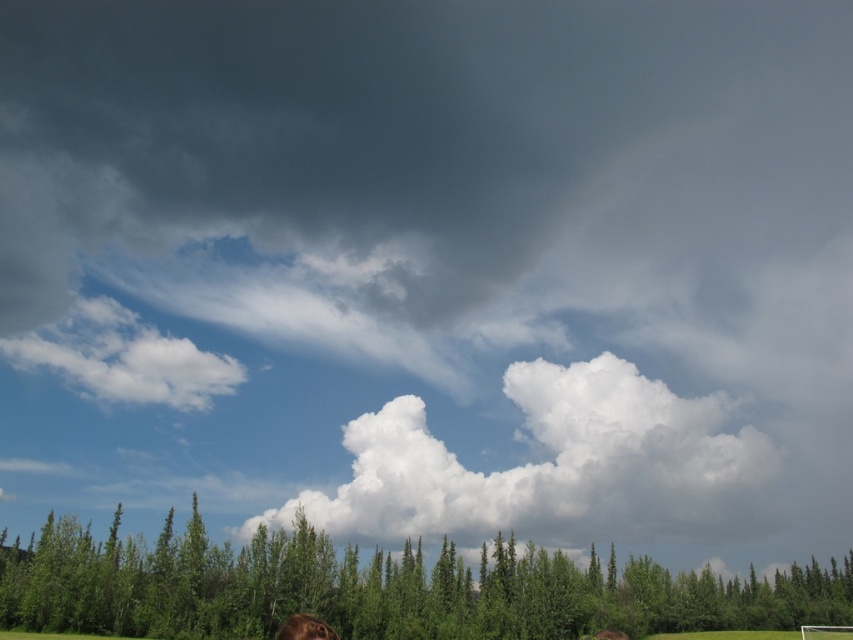
You are an airplane pilot flying through the sky and need to navigate between the white fluffy cloud at center and the white fluffy cloud at upper left. Which cloud should you avoid if you want to choose the smaller one to pass under?

You should avoid the white fluffy cloud at center because it has a larger size compared to the white fluffy cloud at upper left, so the smaller one is the white fluffy cloud at upper left and you can pass under it.

You are an airplane pilot flying at an altitude where you can see both the white fluffy cloud at center and the white fluffy cloud at upper left. Which cloud should you avoid if you need to navigate through the lower altitude area?

You should avoid the white fluffy cloud at center because it is taller than the white fluffy cloud at upper left, making it a potential obstacle at lower altitudes.

You are a weather balloon operator preparing to launch a balloon that can travel up to 100 meters. You see two white fluffy clouds in the sky. If you launch your balloon straight up, will it reach either the white fluffy cloud at center or the white fluffy cloud at upper left?

The distance between the white fluffy cloud at center and the white fluffy cloud at upper left is 85.96 meters. Since your balloon can travel up to 100 meters, it can reach both clouds if launched straight up.